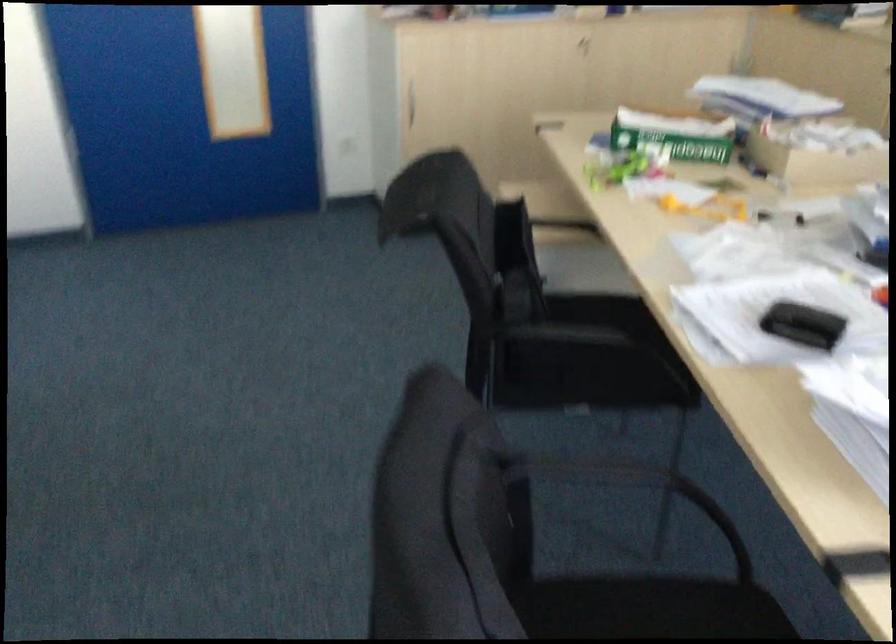
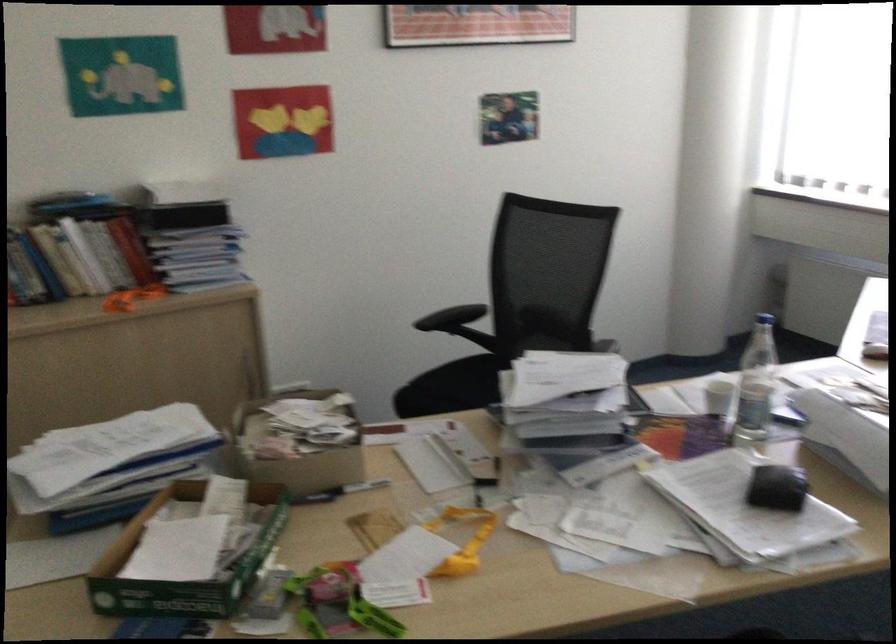
Where in the second image is the point corresponding to pixel 624 176 from the first image?

(345, 603)